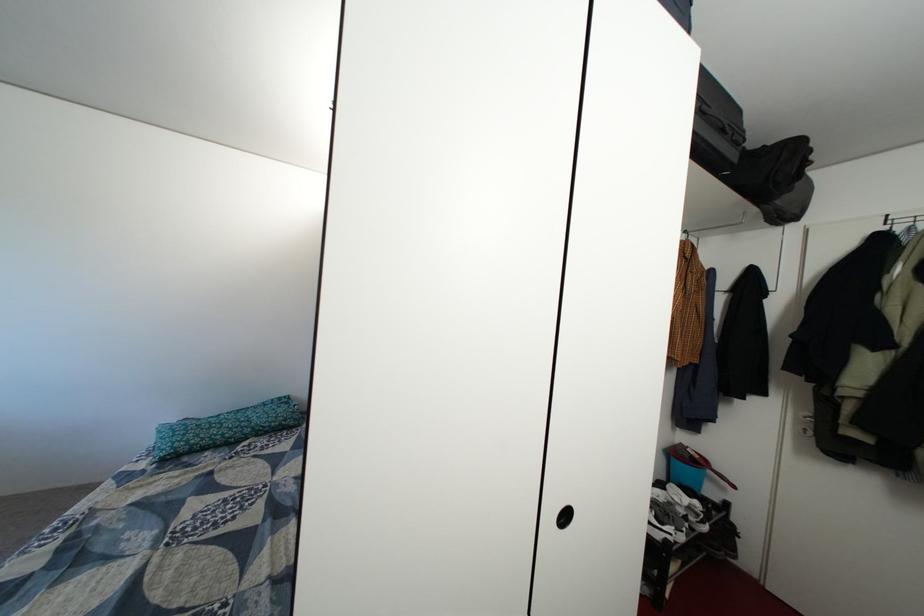
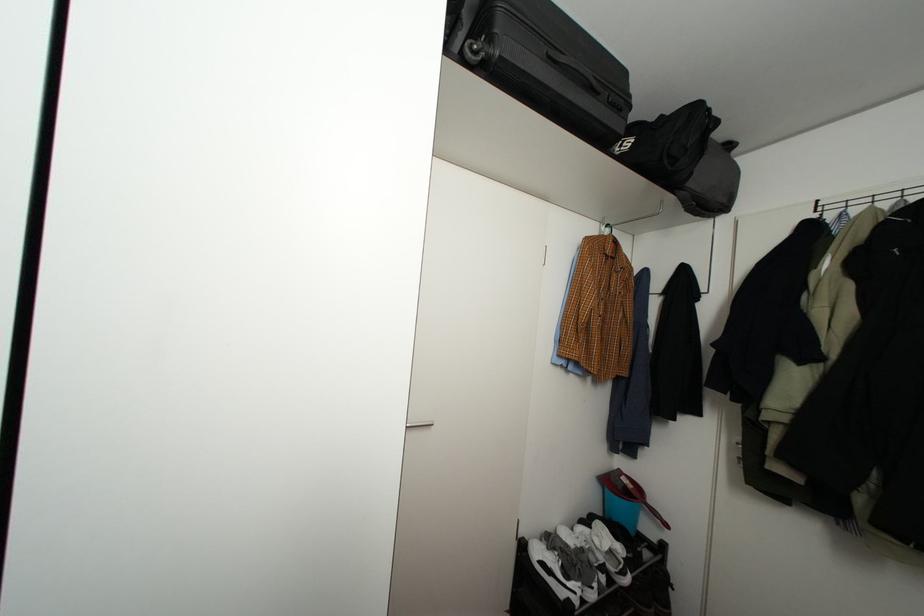
Question: What movement of the cameraman would produce the second image?

Choices:
 (A) Left
 (B) Right
 (C) Forward
 (D) Backward

Answer: (B)